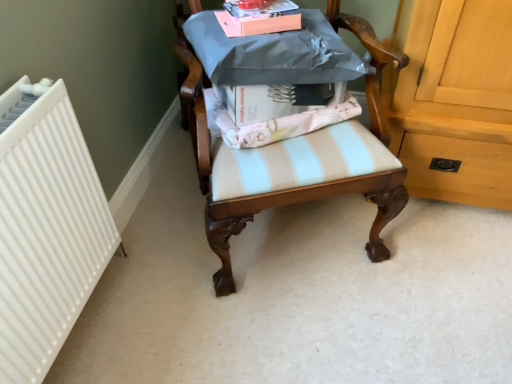
Question: Does white ribbed radiator at left have a smaller size compared to pink matte box at upper center?

Choices:
 (A) yes
 (B) no

Answer: (B)

Question: Is the position of white ribbed radiator at left more distant than that of pink matte box at upper center?

Choices:
 (A) no
 (B) yes

Answer: (B)

Question: Is pink matte box at upper center inside white ribbed radiator at left?

Choices:
 (A) no
 (B) yes

Answer: (A)

Question: Can you confirm if white ribbed radiator at left is wider than pink matte box at upper center?

Choices:
 (A) yes
 (B) no

Answer: (B)

Question: From the image's perspective, is white ribbed radiator at left over pink matte box at upper center?

Choices:
 (A) yes
 (B) no

Answer: (B)

Question: From a real-world perspective, is white ribbed radiator at left positioned under pink matte box at upper center based on gravity?

Choices:
 (A) yes
 (B) no

Answer: (A)

Question: Considering the relative sizes of wooden chair at center and white ribbed radiator at left in the image provided, is wooden chair at center taller than white ribbed radiator at left?

Choices:
 (A) no
 (B) yes

Answer: (B)

Question: From a real-world perspective, is wooden chair at center below white ribbed radiator at left?

Choices:
 (A) no
 (B) yes

Answer: (A)

Question: From the image's perspective, does wooden chair at center appear higher than white ribbed radiator at left?

Choices:
 (A) no
 (B) yes

Answer: (B)

Question: Is wooden chair at center positioned with its back to white ribbed radiator at left?

Choices:
 (A) yes
 (B) no

Answer: (B)

Question: Can you confirm if wooden chair at center is bigger than white ribbed radiator at left?

Choices:
 (A) no
 (B) yes

Answer: (B)

Question: Does wooden chair at center have a lesser width compared to white ribbed radiator at left?

Choices:
 (A) yes
 (B) no

Answer: (B)

Question: Is white ribbed radiator at left positioned beyond the bounds of wooden chair at center?

Choices:
 (A) no
 (B) yes

Answer: (B)